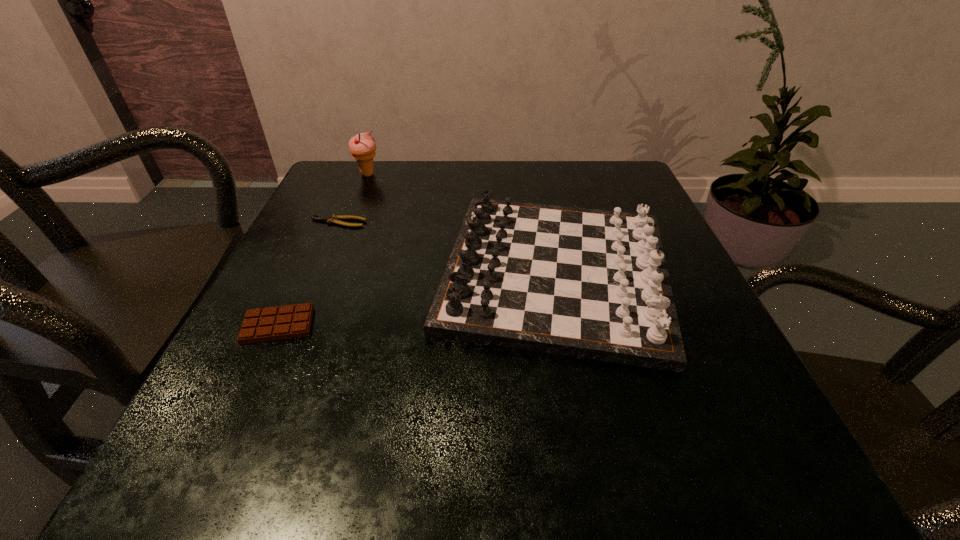
At what (x,y) coordinates should I click in order to perform the action: click on icecream at the far edge. Please return your answer as a coordinate pair (x, y). The width and height of the screenshot is (960, 540). Looking at the image, I should click on (362, 146).

Identify the location of chessboard at the far edge. The width and height of the screenshot is (960, 540). (586, 283).

Where is `icecream located in the left edge section of the desktop`? The image size is (960, 540). icecream located in the left edge section of the desktop is located at coordinates (362, 146).

Image resolution: width=960 pixels, height=540 pixels. Find the location of `candy bar present at the left edge`. candy bar present at the left edge is located at coordinates (290, 321).

Image resolution: width=960 pixels, height=540 pixels. I want to click on pliers that is at the left edge, so click(x=334, y=218).

Identify the location of object positioned at the right edge. The height and width of the screenshot is (540, 960). (586, 283).

The image size is (960, 540). I want to click on object that is at the far left corner, so click(x=362, y=146).

What are the coordinates of `object positioned at the far right corner` in the screenshot? It's located at (586, 283).

Locate an element on the screen. This screenshot has height=540, width=960. vacant region at the far edge of the desktop is located at coordinates (437, 188).

Image resolution: width=960 pixels, height=540 pixels. Find the location of `vacant space at the near edge`. vacant space at the near edge is located at coordinates (566, 484).